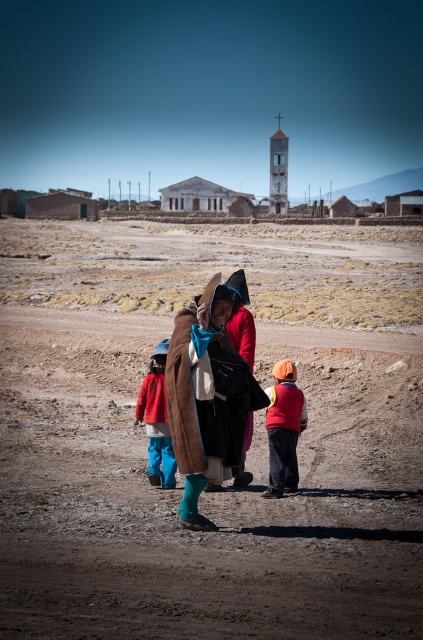
You are standing at the camera position and want to locate the orange knit hat at center. Which direction should you look to see it?

The orange knit hat at center is located at point (283, 428), so you should look towards the center of the image to see it.

You are standing on the dirt road and see the brown woolen coat at center and the orange knit hat at center. Which one is more to the left?

The brown woolen coat at center is more to the left because it is positioned on the left side of the orange knit hat at center.